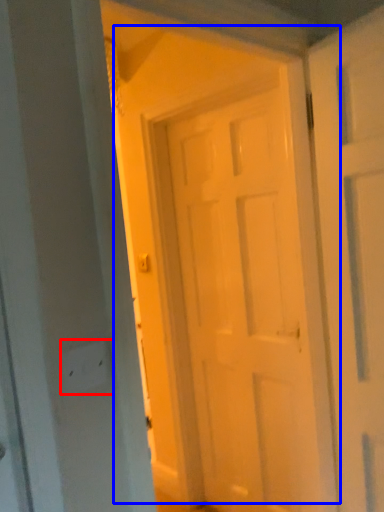
Question: Among these objects, which one is nearest to the camera, electric outlet (highlighted by a red box) or door (highlighted by a blue box)?

Choices:
 (A) electric outlet
 (B) door

Answer: (A)